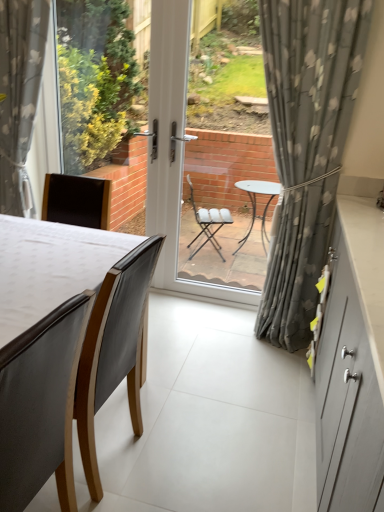
The image size is (384, 512). Find the location of `vacant region to the left of gray floral curtain at center, placed as the second curtain when sorted from left to right`. vacant region to the left of gray floral curtain at center, placed as the second curtain when sorted from left to right is located at coordinates (195, 334).